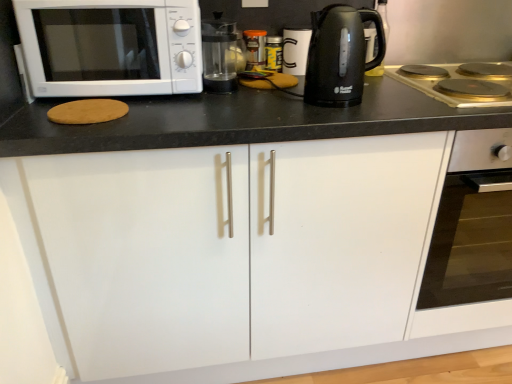
This screenshot has height=384, width=512. Identify the location of free space to the right of white matte microwave at left. (255, 100).